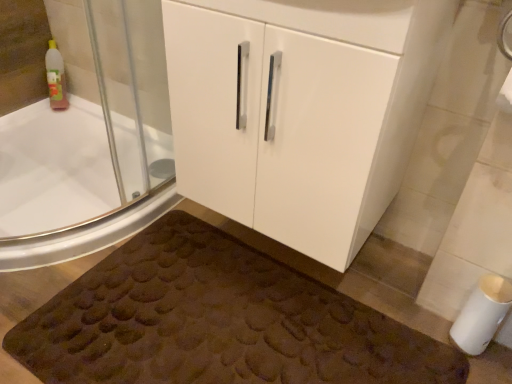
The height and width of the screenshot is (384, 512). What are the coordinates of `free region on the left part of white glossy bathtub at upper left` in the screenshot? It's located at (44, 199).